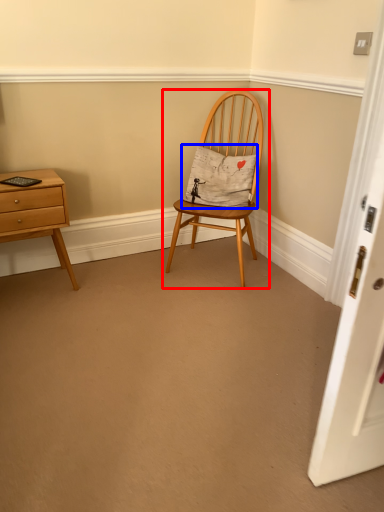
Question: Which point is closer to the camera, chair (highlighted by a red box) or pillow (highlighted by a blue box)?

Choices:
 (A) chair
 (B) pillow

Answer: (A)